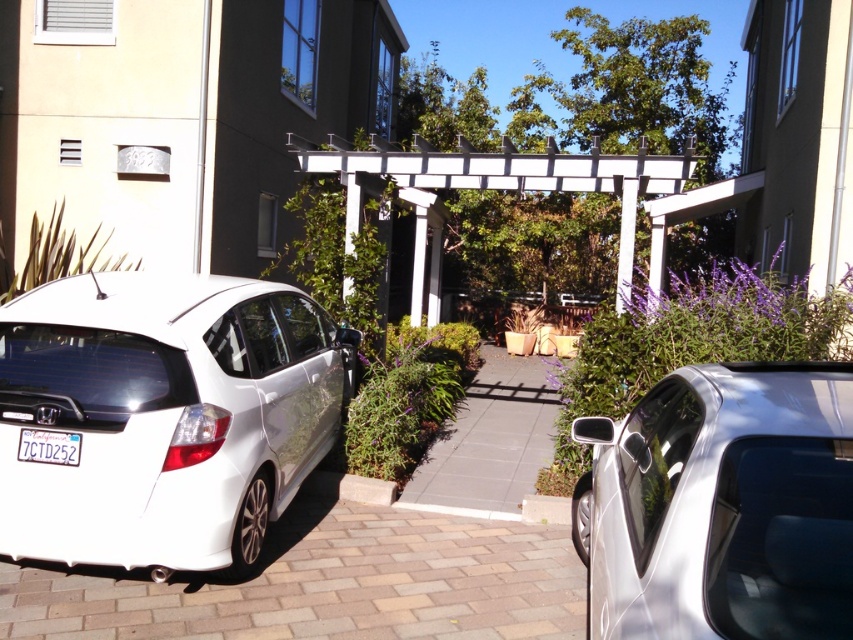
You are standing at the entrance of the driveway and want to park your car in the residential area. The white Honda car is already parked on the driveway. There is a point marked at coordinates point (164, 416). Can you determine if this point is near the white Honda car?

The point (164, 416) corresponds to the white glossy hatchback at lower left, which is the white Honda car parked on the driveway. Therefore, the point is near the white Honda car.

You are standing at the entrance of the residential area and want to park your car on the gray concrete driveway at center. Based on the scene description, can you determine if there is enough space to park there?

The gray concrete driveway at center is located at point (490, 442), which suggests it is positioned towards the lower right of the image. However, the scene mentions a white Honda car already parked on the driveway and a silver car partially visible to the right. Without specific measurements of the driveway size or the available space, it is unclear if there is enough room to park your car there.